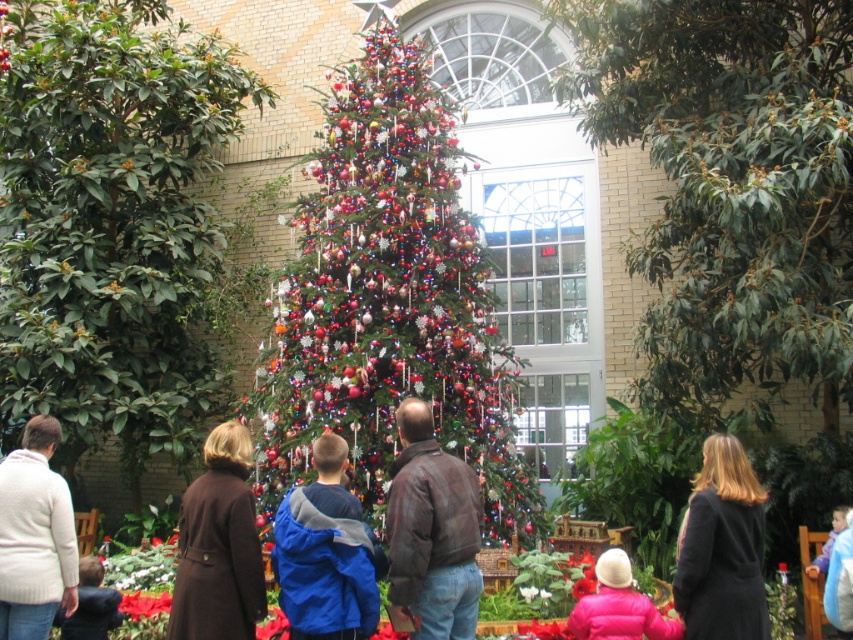
You are a photographer trying to capture a clear shot of the pink matte jacket at lower center without the shiny green christmas tree at center blocking it. Where should you move to achieve this?

The shiny green christmas tree at center is positioned over the pink matte jacket at lower center. To avoid the tree blocking the jacket, move to a lower angle or position yourself below the tree so that the jacket becomes visible beneath it.